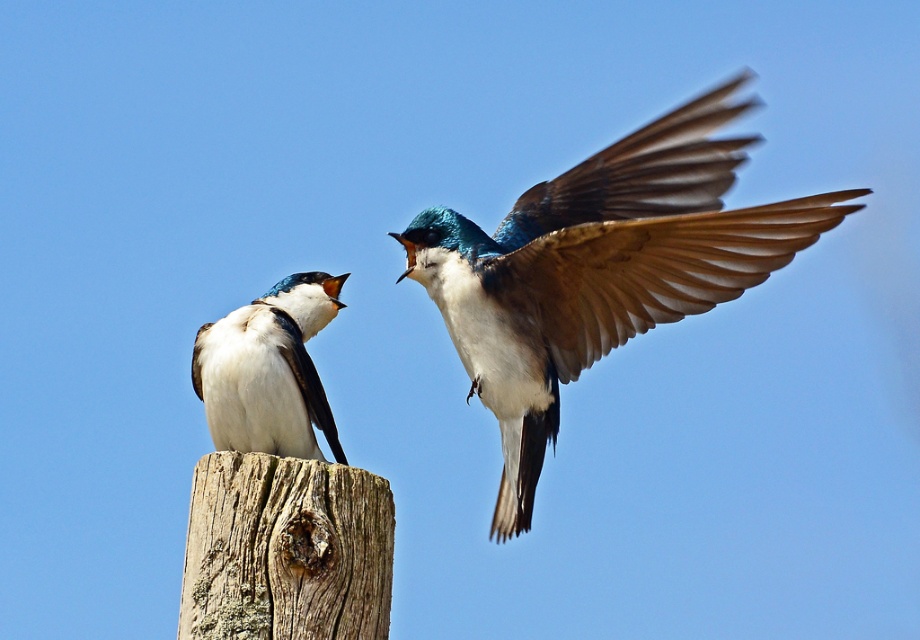
You are a birdwatcher observing two birds on a wooden post. You see the shiny blue and white bird at center and the white matte bird at left. Which bird is positioned to the right of the other?

The shiny blue and white bird at center is positioned to the right of the white matte bird at left.

You are observing two birds on a wooden post. The first bird is at point [618,305], and the second is at point [306,442]. Which bird is closer to the front of the post?

Point [306,442] is closer to the front of the post because it is in front of point [618,305].